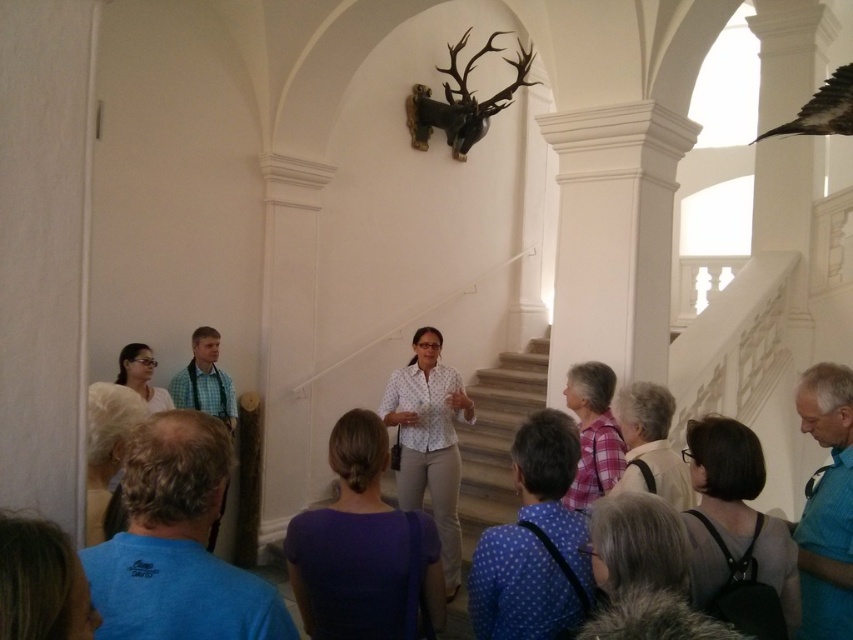
Question: Is the position of white dotted shirt at center more distant than that of dark brown feathered bird at upper right?

Choices:
 (A) yes
 (B) no

Answer: (A)

Question: Does blue striped shirt at lower right appear under white dotted shirt at center?

Choices:
 (A) no
 (B) yes

Answer: (A)

Question: Can you confirm if blue striped shirt at lower right is wider than green checkered shirt at center?

Choices:
 (A) yes
 (B) no

Answer: (A)

Question: Which of these objects is positioned closest to the blue t-shirt at lower left?

Choices:
 (A) dark brown feathered bird at upper right
 (B) green checkered shirt at center
 (C) blue striped shirt at lower right

Answer: (C)

Question: Which point is closer to the camera?

Choices:
 (A) green checkered shirt at center
 (B) dark brown feathered bird at upper right
 (C) blue striped shirt at lower right

Answer: (C)

Question: Estimate the real-world distances between objects in this image. Which object is closer to the dark brown feathered bird at upper right?

Choices:
 (A) white dotted shirt at center
 (B) blue t-shirt at lower left
 (C) blue striped shirt at lower right
 (D) green checkered shirt at center

Answer: (C)